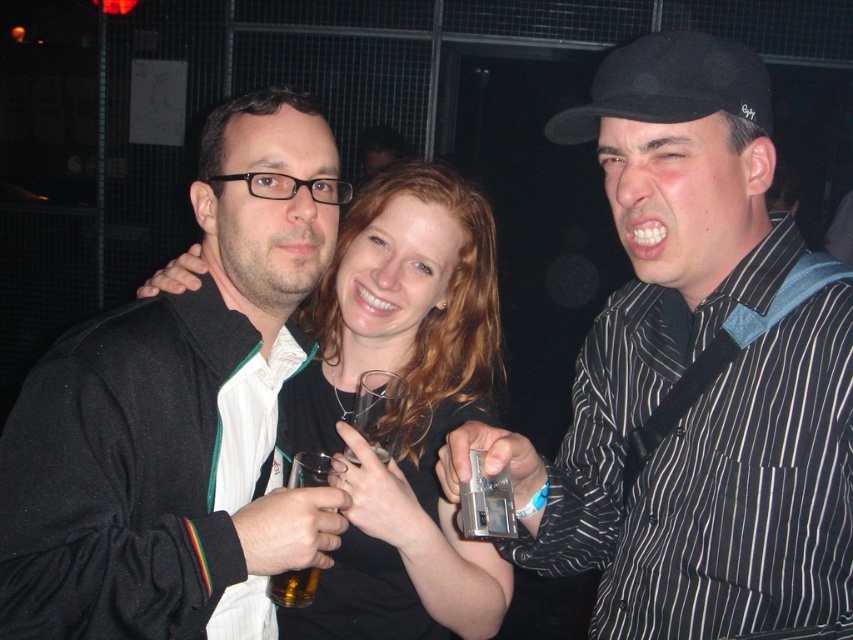
You are standing in the crowd at this party and want to hand a drink to both the black striped shirt at center and the black matte baseball cap at right. Which one should you approach first if you want to give the drink to the person closer to you?

The black striped shirt at center is below the black matte baseball cap at right, so the black striped shirt at center is closer to you. You should approach the black striped shirt at center first.

You are a photographer at the event and want to capture a clear shot of the translucent glass beer at center without the black striped shirt at center blocking it. Is this possible given their current positions?

The black striped shirt at center is positioned over the translucent glass beer at center, so it would block the view. To capture a clear shot of the translucent glass beer at center, you would need to adjust the angle or have the person move so the shirt is no longer covering the glass.